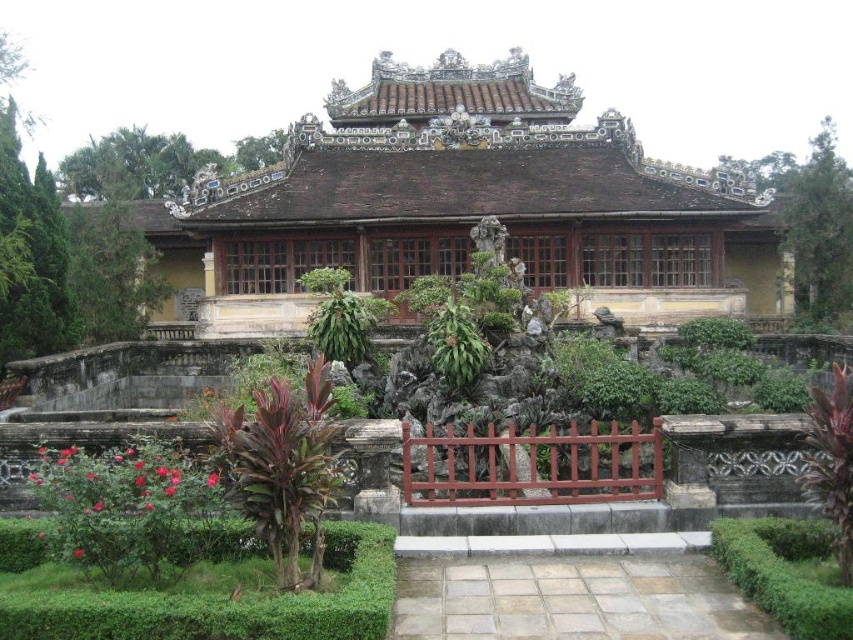
You are standing at the entrance of the temple and want to find the red matte rose bush at lower left. Based on the coordinates provided, where should you look relative to your current position?

The red matte rose bush at lower left is located at coordinates point (131, 508), which means it is positioned to the lower left relative to your current position at the entrance.

Looking at this image, you are a gardener planning to place a new statue that requires a space of 1.2 meters in width. You see the red matte rose bush at lower left and the green leafy plant at center. Which plant should you consider for the statue placement based on their widths?

The red matte rose bush at lower left might be wider than green leafy plant at center, so you should consider placing the statue near the green leafy plant at center as it may have sufficient space.

You are a gardener who needs to water both the red matte rose bush at lower left and the green leafy plant at center. If your watering can holds enough water for 10 meters of travel, can you water both plants without refilling?

The red matte rose bush at lower left and green leafy plant at center are 12.39 meters apart from each other. Since the distance exceeds the watering can capacity of 10 meters, you cannot water both plants without refilling.